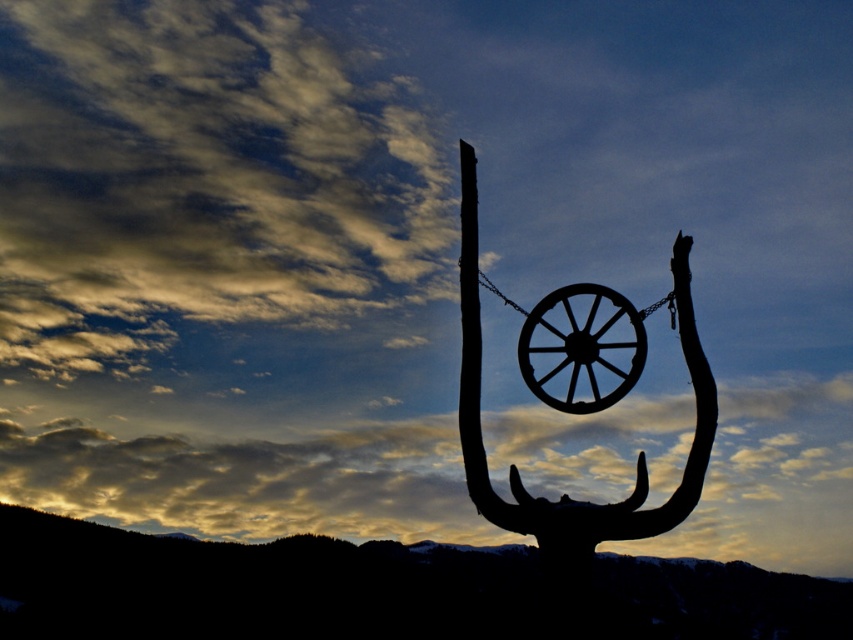
You are an artist analyzing the composition of the scene. You notice the silvery metal wagon wheel at center and the black matte wheel at center. Which one is positioned higher in the image?

The silvery metal wagon wheel at center is positioned higher than the black matte wheel at center according to the description.

You are an architect designing a new sculpture and want to ensure proper alignment. Given the coordinates provided, is the silvery metal wagon wheel at center positioned exactly at the center of the image?

The silvery metal wagon wheel at center is located at point (566, 496), which is not the exact center of the image. The exact center would typically be at coordinates like (426, 320), so the wheel is offset to the right and slightly downward from the true center.